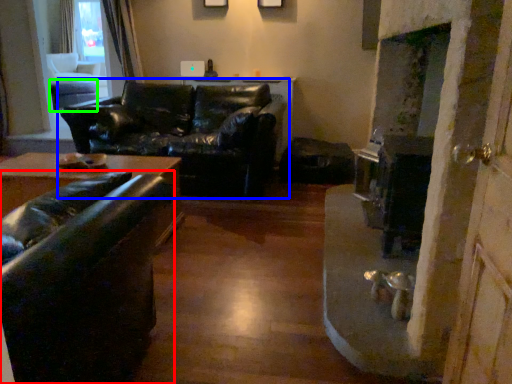
Question: Which object is the farthest from studio couch (highlighted by a red box)? Choose among these: studio couch (highlighted by a blue box) or table (highlighted by a green box).

Choices:
 (A) studio couch
 (B) table

Answer: (B)